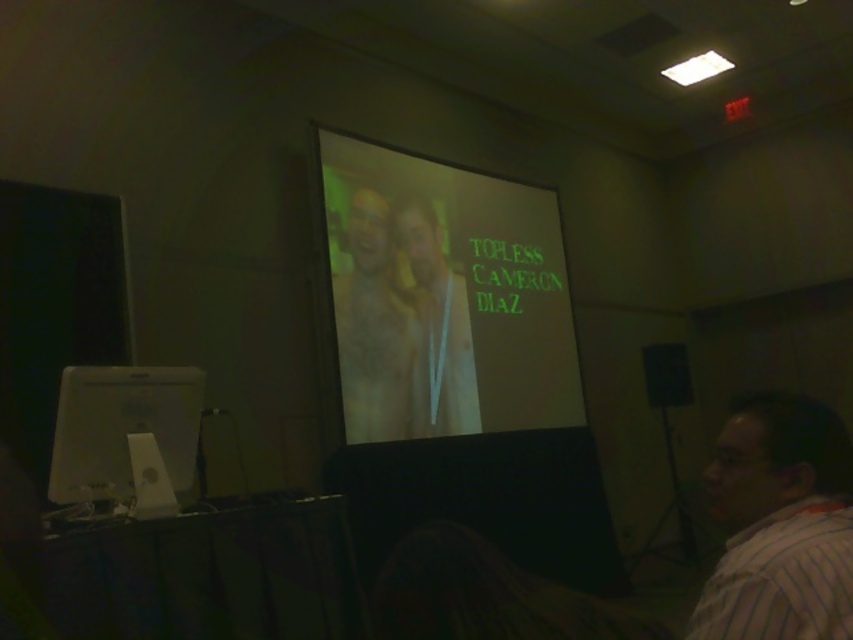
You are standing in the room where the presentation is happening. You notice a point marked at coordinates (779, 524). Which object in the scene does this point correspond to?

The point at coordinates (779, 524) corresponds to the striped cotton shirt at lower right.

You are an event organizer who needs to adjust the seating arrangement for better visibility. You have a white glossy computer screen at lower left and a matte yellow shirt at center. Which object is smaller and requires less space for adjustment?

The white glossy computer screen at lower left is smaller than the matte yellow shirt at center, so it requires less space for adjustment.